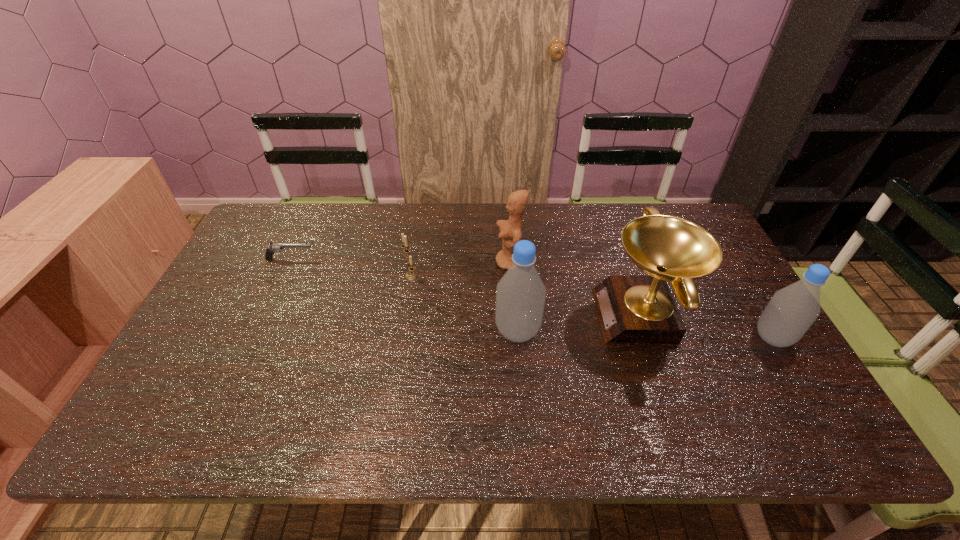
Where is `vacant region between the figurine and the fifth object from left to right`? The width and height of the screenshot is (960, 540). vacant region between the figurine and the fifth object from left to right is located at coordinates (576, 289).

Locate an element on the screen. free space between the pistol and the candle is located at coordinates (350, 267).

Locate an element on the screen. free space between the figurine and the candle is located at coordinates coord(461,269).

Identify which object is located as the second nearest to the left bottle. Please provide its 2D coordinates. Your answer should be formatted as a tuple, i.e. [(x, y)], where the tuple contains the x and y coordinates of a point satisfying the conditions above.

[(632, 309)]

Identify which object is located as the third nearest to the rightmost object. Please provide its 2D coordinates. Your answer should be formatted as a tuple, i.e. [(x, y)], where the tuple contains the x and y coordinates of a point satisfying the conditions above.

[(510, 230)]

Locate an element on the screen. The width and height of the screenshot is (960, 540). free space that satisfies the following two spatial constraints: 1. on the back side of the taller bottle; 2. on the front-facing side of the figurine is located at coordinates (512, 262).

This screenshot has width=960, height=540. I want to click on free location that satisfies the following two spatial constraints: 1. on the front-facing side of the second object from right to left; 2. on the back side of the right bottle, so click(x=649, y=338).

Find the location of `vacant region that satisfies the following two spatial constraints: 1. on the front-facing side of the leftmost object; 2. on the right side of the fifth object from right to left`. vacant region that satisfies the following two spatial constraints: 1. on the front-facing side of the leftmost object; 2. on the right side of the fifth object from right to left is located at coordinates (282, 276).

Where is `vacant region that satisfies the following two spatial constraints: 1. on the front-facing side of the figurine; 2. on the back side of the left bottle`? The width and height of the screenshot is (960, 540). vacant region that satisfies the following two spatial constraints: 1. on the front-facing side of the figurine; 2. on the back side of the left bottle is located at coordinates (516, 331).

Locate an element on the screen. The height and width of the screenshot is (540, 960). free spot that satisfies the following two spatial constraints: 1. on the front-facing side of the left bottle; 2. on the left side of the shortest object is located at coordinates (257, 331).